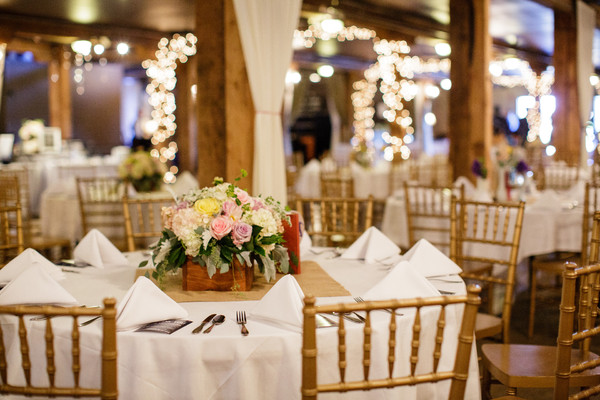
The width and height of the screenshot is (600, 400). Identify the location of butter knife. 208,318.